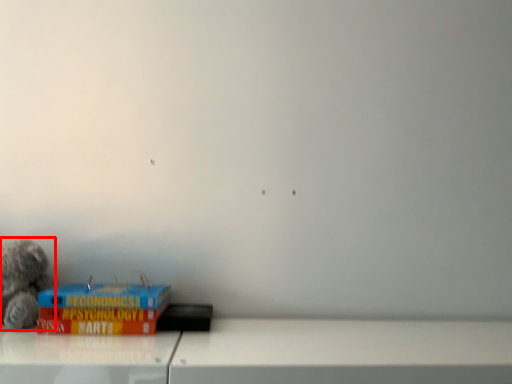
Question: Observing the image, what is the correct spatial positioning of toy (annotated by the red box) in reference to paperback book?

Choices:
 (A) right
 (B) left

Answer: (B)